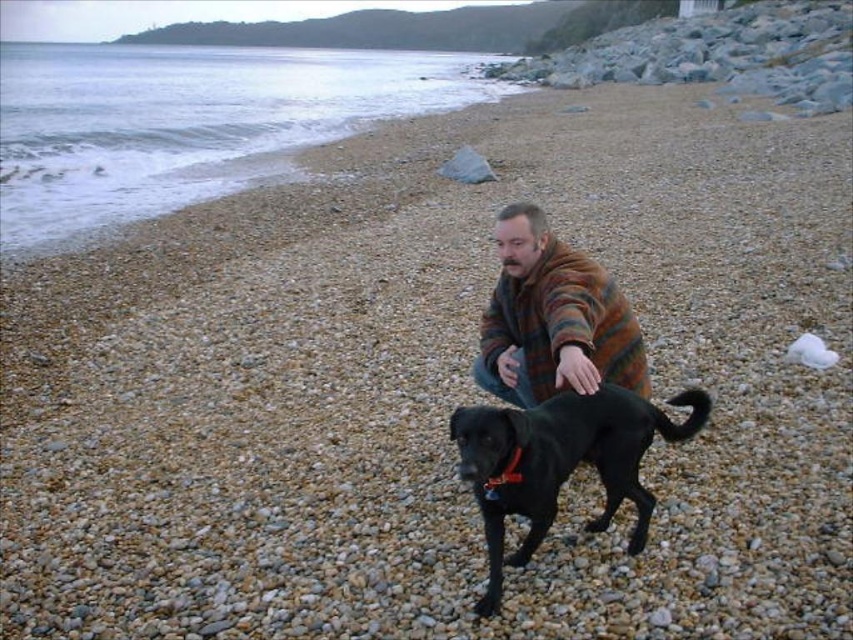
Question: Where is smooth sand at lower left located in relation to gray rock at upper right in the image?

Choices:
 (A) left
 (B) right

Answer: (A)

Question: Which of the following is the farthest from the observer?

Choices:
 (A) (460, 445)
 (B) (564, 387)
 (C) (699, 20)

Answer: (C)

Question: Which object is positioned closest to the gray rock at upper right?

Choices:
 (A) striped woolen sweater at center
 (B) smooth sand at lower left
 (C) black matte dog at center

Answer: (B)

Question: Is gray rock at upper right further to camera compared to striped woolen sweater at center?

Choices:
 (A) yes
 (B) no

Answer: (A)

Question: Does black matte dog at center have a smaller size compared to gray rock at upper right?

Choices:
 (A) yes
 (B) no

Answer: (A)

Question: Estimate the real-world distances between objects in this image. Which object is closer to the gray rock at upper right?

Choices:
 (A) smooth sand at lower left
 (B) black matte dog at center
 (C) striped woolen sweater at center

Answer: (A)